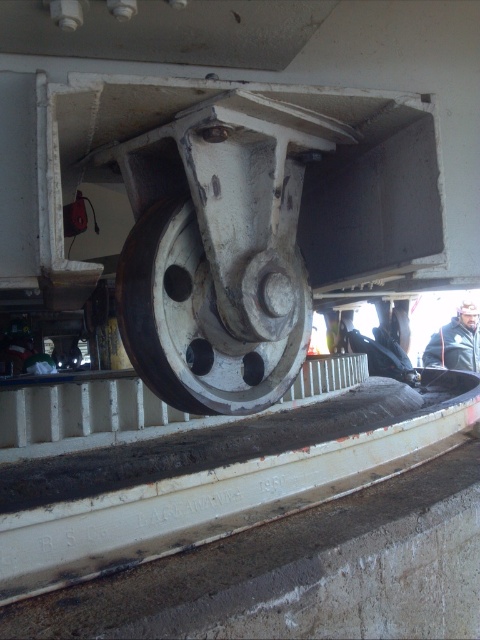
You are a maintenance worker inspecting the machinery. You notice the white matte wheel at center and the dark blue jacket at lower right. Which object is positioned higher in the image?

The white matte wheel at center is above the dark blue jacket at lower right, so it is positioned higher in the image.

You are a maintenance worker inspecting the machinery. You need to determine if the white matte wheel at center can fit through a narrow opening that is the same width as the dark blue jacket at lower right. Can it pass through?

The white matte wheel at center is thinner than the dark blue jacket at lower right, so it can pass through the opening since its width is smaller than the jacket.